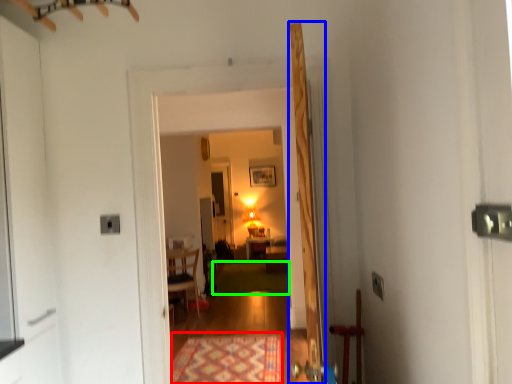
Question: Which object is the closest to the mat (highlighted by a red box)? Choose among these: door (highlighted by a blue box) or mat (highlighted by a green box).

Choices:
 (A) door
 (B) mat

Answer: (A)